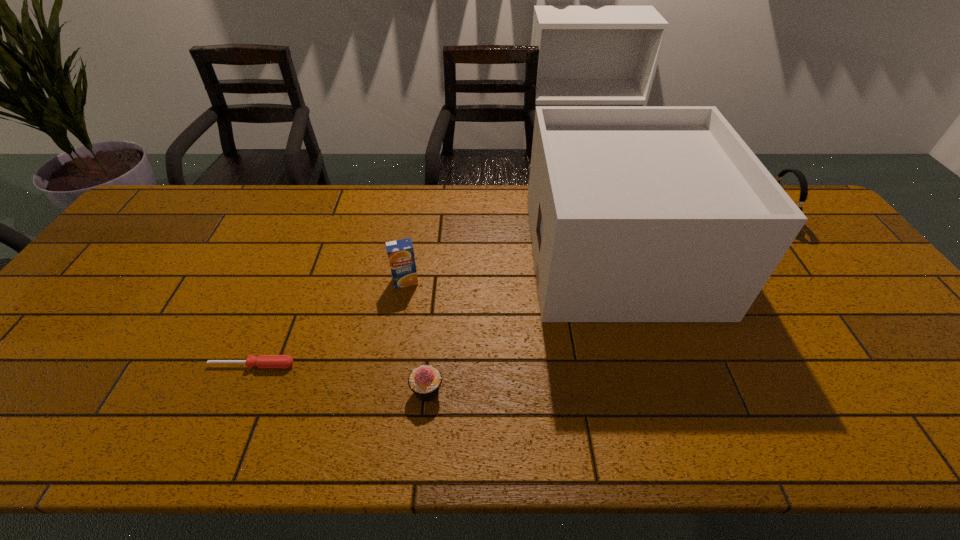
The width and height of the screenshot is (960, 540). What are the coordinates of `vacant space that is in between the screwdriver and the box` in the screenshot? It's located at (436, 310).

Locate an element on the screen. The image size is (960, 540). free point between the second object from left to right and the tallest object is located at coordinates (513, 268).

Locate an element on the screen. This screenshot has height=540, width=960. vacant space in between the nearest object and the screwdriver is located at coordinates (340, 378).

Locate an element on the screen. Image resolution: width=960 pixels, height=540 pixels. free area in between the cupcake and the screwdriver is located at coordinates (340, 378).

I want to click on free spot between the third tallest object and the tallest object, so click(513, 268).

Point out which object is positioned as the fourth nearest to the nearest object. Please provide its 2D coordinates. Your answer should be formatted as a tuple, i.e. [(x, y)], where the tuple contains the x and y coordinates of a point satisfying the conditions above.

[(802, 179)]

Locate an element on the screen. the closest object relative to the screwdriver is located at coordinates (425, 381).

The height and width of the screenshot is (540, 960). Find the location of `vacant point that satisfies the following two spatial constraints: 1. on the front side of the orange_juice; 2. on the left side of the cupcake`. vacant point that satisfies the following two spatial constraints: 1. on the front side of the orange_juice; 2. on the left side of the cupcake is located at coordinates (388, 391).

At what (x,y) coordinates should I click in order to perform the action: click on vacant area in the image that satisfies the following two spatial constraints: 1. on the front side of the orange_juice; 2. on the right side of the cupcake. Please return your answer as a coordinate pair (x, y). This screenshot has width=960, height=540. Looking at the image, I should click on (388, 391).

The image size is (960, 540). Find the location of `free spot that satisfies the following two spatial constraints: 1. on the side of the second object from right to left with the window; 2. on the front side of the fourth tallest object`. free spot that satisfies the following two spatial constraints: 1. on the side of the second object from right to left with the window; 2. on the front side of the fourth tallest object is located at coordinates (663, 391).